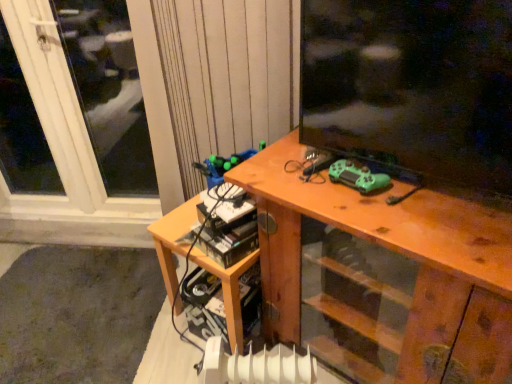
Question: Considering their positions, is white plastic window at upper left located in front of or behind wooden table at lower left?

Choices:
 (A) behind
 (B) front

Answer: (A)

Question: Is white plastic window at upper left to the left or to the right of wooden table at lower left in the image?

Choices:
 (A) left
 (B) right

Answer: (A)

Question: Considering the real-world distances, which object is closest to the matte black tv at upper right?

Choices:
 (A) green matte game controller at center
 (B) wooden table at lower left
 (C) white plastic radiator at lower center
 (D) white plastic window at upper left
 (E) wooden desk at center

Answer: (A)

Question: Estimate the real-world distances between objects in this image. Which object is closer to the wooden table at lower left?

Choices:
 (A) white plastic window at upper left
 (B) wooden desk at center
 (C) green matte game controller at center
 (D) white plastic radiator at lower center
 (E) matte black tv at upper right

Answer: (D)